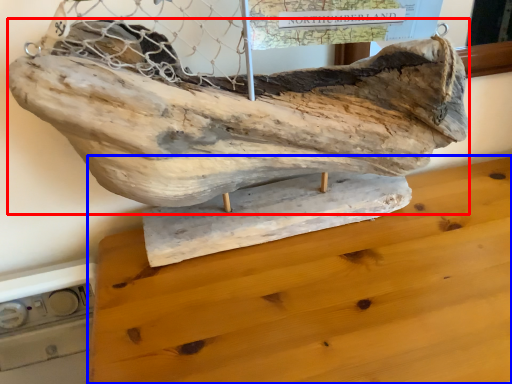
Question: Which point is closer to the camera, sculpture (highlighted by a red box) or furniture (highlighted by a blue box)?

Choices:
 (A) sculpture
 (B) furniture

Answer: (B)